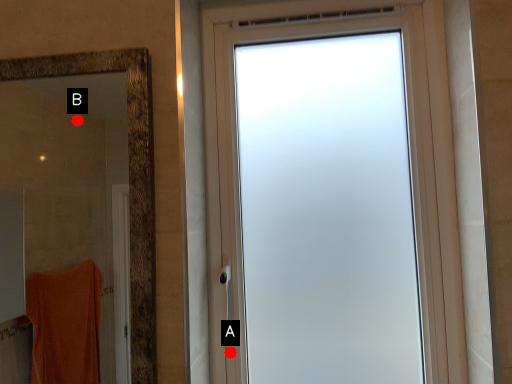
Question: Two points are circled on the image, labeled by A and B beside each circle. Which point is further to the camera?

Choices:
 (A) A is further
 (B) B is further

Answer: (B)